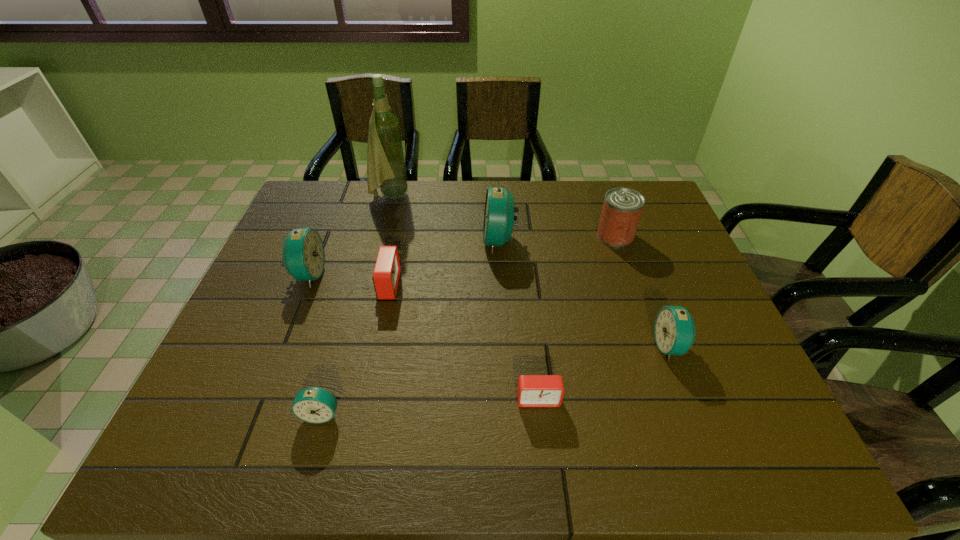
Where is `vacant space situated on the right of the can`? This screenshot has height=540, width=960. vacant space situated on the right of the can is located at coordinates (673, 235).

Image resolution: width=960 pixels, height=540 pixels. I want to click on vacant space located 0.110m on the front-facing side of the third farthest blue alarm clock, so click(x=609, y=346).

The width and height of the screenshot is (960, 540). What are the coordinates of `vacant space located on the front-facing side of the third farthest blue alarm clock` in the screenshot? It's located at [x=510, y=346].

The width and height of the screenshot is (960, 540). Find the location of `free space located 0.060m on the front-facing side of the third farthest blue alarm clock`. free space located 0.060m on the front-facing side of the third farthest blue alarm clock is located at coordinates (630, 346).

The width and height of the screenshot is (960, 540). In order to click on blank area located 0.100m on the front-facing side of the left red alarm clock in this screenshot , I will do `click(437, 286)`.

Locate an element on the screen. Image resolution: width=960 pixels, height=540 pixels. vacant region located 0.050m on the front-facing side of the third blue alarm clock from right to left is located at coordinates (311, 450).

The height and width of the screenshot is (540, 960). I want to click on blank area located 0.100m on the front-facing side of the right red alarm clock, so click(544, 456).

I want to click on object that is positioned at the far edge, so click(386, 169).

At what (x,y) coordinates should I click in order to perform the action: click on object present at the near edge. Please return your answer as a coordinate pair (x, y). The image size is (960, 540). Looking at the image, I should click on (316, 405).

Find the location of a particular element. The width and height of the screenshot is (960, 540). object that is at the left edge is located at coordinates (303, 253).